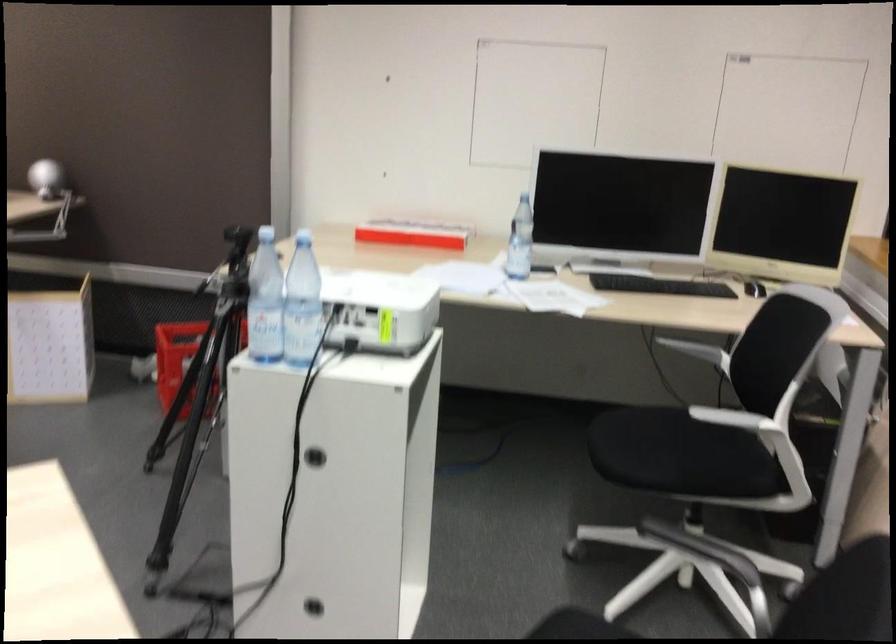
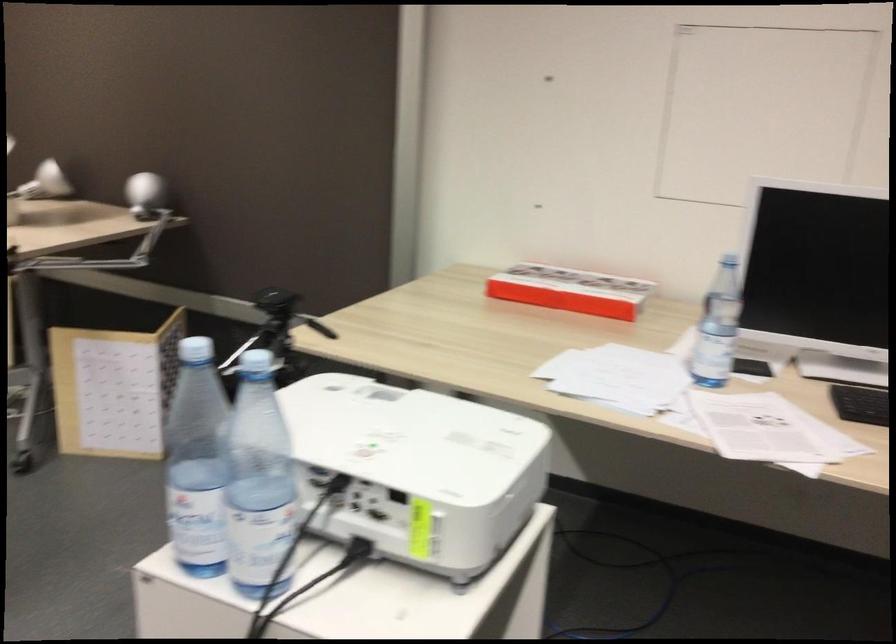
Question: I am providing you with two images of the same scene from different viewpoints. Please identify which objects are invisible in image2.

Choices:
 (A) red and yellow ball
 (B) red cardboard box
 (C) clear plastic bottle
 (D) red plastic crate

Answer: (D)